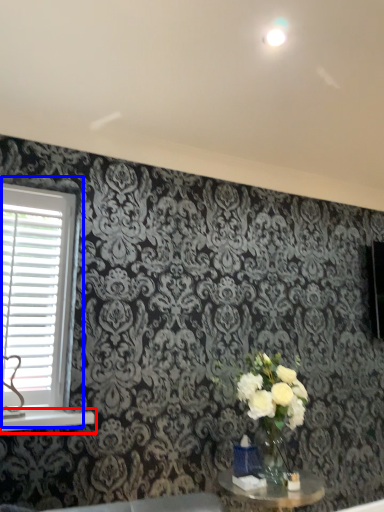
Question: Among these objects, which one is nearest to the camera, window sill (highlighted by a red box) or window (highlighted by a blue box)?

Choices:
 (A) window sill
 (B) window

Answer: (A)